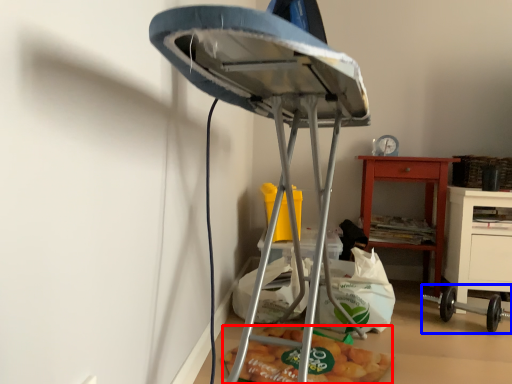
Question: Which of the following is the closest to the observer, food (highlighted by a red box) or equipment (highlighted by a blue box)?

Choices:
 (A) food
 (B) equipment

Answer: (A)